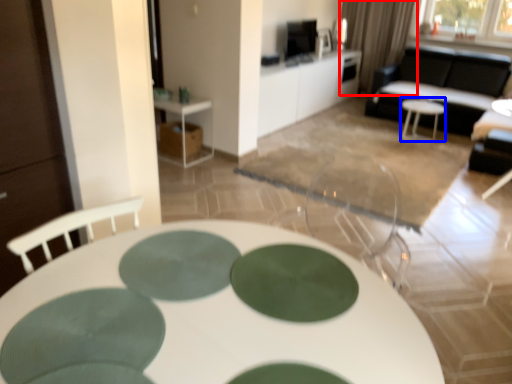
Question: Which object appears farthest to the camera in this image, curtain (highlighted by a red box) or side table (highlighted by a blue box)?

Choices:
 (A) curtain
 (B) side table

Answer: (A)